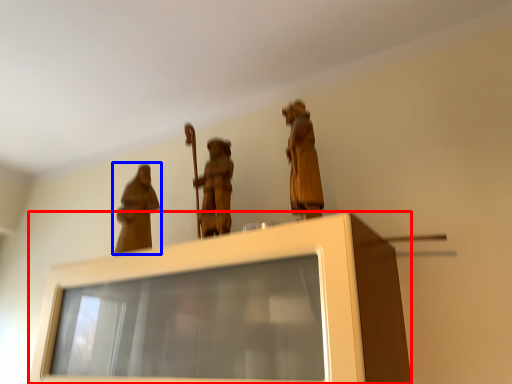
Question: Which object is closer to the camera taking this photo, furniture (highlighted by a red box) or person (highlighted by a blue box)?

Choices:
 (A) furniture
 (B) person

Answer: (A)